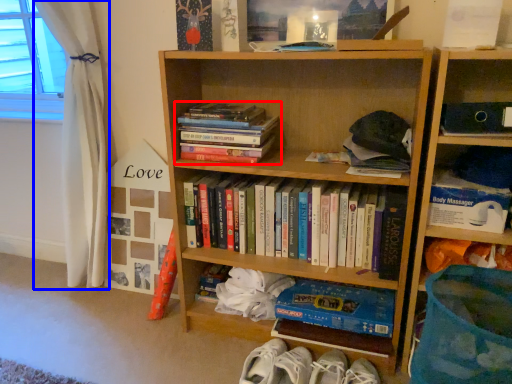
Question: Which object is further to the camera taking this photo, book (highlighted by a red box) or curtain (highlighted by a blue box)?

Choices:
 (A) book
 (B) curtain

Answer: (B)